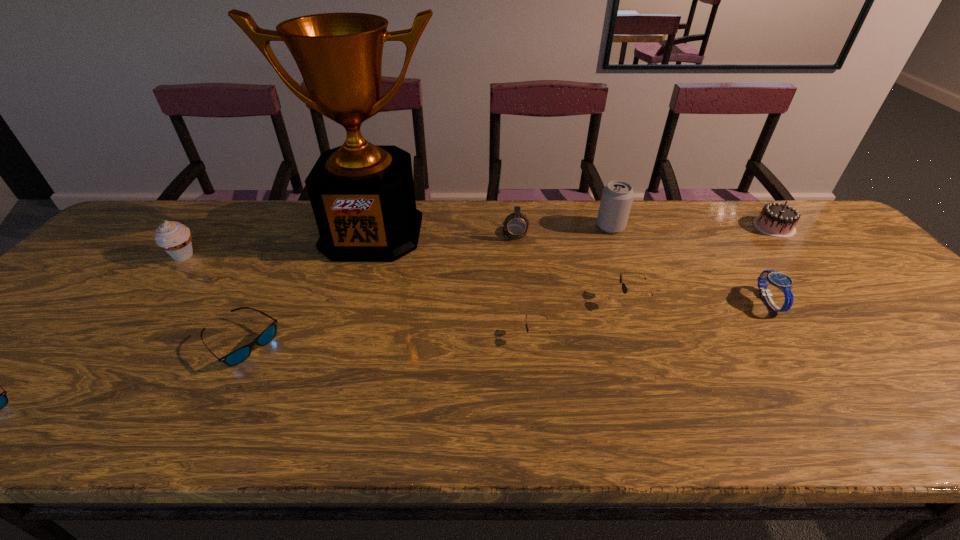
The height and width of the screenshot is (540, 960). What are the coordinates of `free spot located in front of the lenses of the rightmost sunglasses` in the screenshot? It's located at (532, 300).

Locate an element on the screen. free space located 0.260m in front of the lenses of the rightmost sunglasses is located at coordinates (512, 300).

Locate an element on the screen. Image resolution: width=960 pixels, height=540 pixels. vacant space located 0.330m in front of the lenses of the rightmost sunglasses is located at coordinates (484, 300).

Find the location of a particular element. This screenshot has height=540, width=960. free space located 0.060m on the front of the blue watch is located at coordinates (794, 338).

Identify the location of vacant space located 0.350m in front of the lenses of the left black sunglasses. (372, 336).

Find the location of a particular element. Image resolution: width=960 pixels, height=540 pixels. free space located 0.070m in front of the lenses of the left black sunglasses is located at coordinates (493, 336).

This screenshot has width=960, height=540. I want to click on free region located 0.180m in front of the lenses of the left black sunglasses, so click(x=445, y=336).

This screenshot has width=960, height=540. Identify the location of vacant region located at the front of the third sunglasses from right to left showing the lenses. (307, 343).

Where is `trophy cup that is at the far edge`? The height and width of the screenshot is (540, 960). trophy cup that is at the far edge is located at coordinates (362, 195).

Where is `can located at the far edge`? The image size is (960, 540). can located at the far edge is located at coordinates (617, 196).